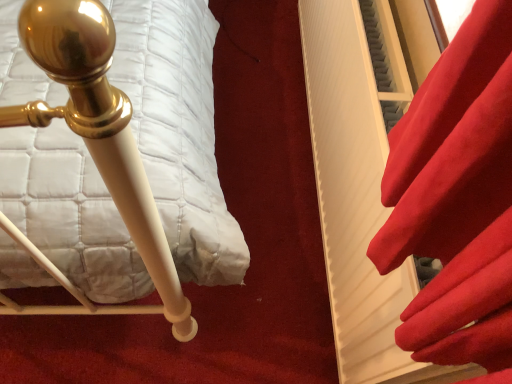
Describe the element at coordinates (457, 200) in the screenshot. This screenshot has height=384, width=512. I see `satin red curtain at right` at that location.

I want to click on satin red curtain at right, so click(x=457, y=200).

Measure the distance between satin red curtain at right and camera.

satin red curtain at right and camera are 12.86 inches apart from each other.

Identify the location of matte white bedpost at left. The width and height of the screenshot is (512, 384). (94, 148).

What do you see at coordinates (94, 148) in the screenshot?
I see `matte white bedpost at left` at bounding box center [94, 148].

Measure the distance between matte white bedpost at left and camera.

The depth of matte white bedpost at left is 30.01 centimeters.

Identify the location of satin red curtain at right. The image size is (512, 384). (457, 200).

Considering the relative positions of matte white bedpost at left and satin red curtain at right in the image provided, is matte white bedpost at left to the left or to the right of satin red curtain at right?

From the image, it's evident that matte white bedpost at left is to the left of satin red curtain at right.

Is matte white bedpost at left positioned behind satin red curtain at right?

Yes, matte white bedpost at left is behind satin red curtain at right.

Which point is more distant from viewer, (104, 309) or (385, 257)?

The point (104, 309) is farther.

From the image's perspective, is matte white bedpost at left located above or below satin red curtain at right?

matte white bedpost at left is below satin red curtain at right.

From a real-world perspective, is matte white bedpost at left positioned above or below satin red curtain at right?

In terms of real-world spatial position, matte white bedpost at left is below satin red curtain at right.

Considering the sizes of objects matte white bedpost at left and satin red curtain at right in the image provided, who is wider, matte white bedpost at left or satin red curtain at right?

With larger width is matte white bedpost at left.

Who is shorter, matte white bedpost at left or satin red curtain at right?

matte white bedpost at left.

Can you confirm if matte white bedpost at left is smaller than satin red curtain at right?

Actually, matte white bedpost at left might be larger than satin red curtain at right.

Is matte white bedpost at left spatially inside satin red curtain at right, or outside of it?

matte white bedpost at left cannot be found inside satin red curtain at right.

Is there a large distance between matte white bedpost at left and satin red curtain at right?

That's not correct — matte white bedpost at left is a little close to satin red curtain at right.

Is satin red curtain at right at the back of matte white bedpost at left?

No, matte white bedpost at left is not facing the opposite direction of satin red curtain at right.

Looking at this image, can you tell me how much matte white bedpost at left and satin red curtain at right differ in facing direction?

matte white bedpost at left and satin red curtain at right are facing 0.205 degrees away from each other.

Measure the distance between matte white bedpost at left and satin red curtain at right.

matte white bedpost at left is 16.22 inches from satin red curtain at right.

This screenshot has height=384, width=512. In order to click on furniture lying behind the satin red curtain at right in this screenshot , I will do `click(94, 148)`.

Which is more to the right, satin red curtain at right or matte white bedpost at left?

satin red curtain at right.

Is satin red curtain at right in front of matte white bedpost at left?

Yes, satin red curtain at right is in front of matte white bedpost at left.

Does point (449, 236) lie in front of point (10, 228)?

Yes, it is.

From the image's perspective, between satin red curtain at right and matte white bedpost at left, which one is located above?

satin red curtain at right appears higher in the image.

From a real-world perspective, is satin red curtain at right positioned above or below matte white bedpost at left?

satin red curtain at right is situated higher than matte white bedpost at left in the real world.

Between satin red curtain at right and matte white bedpost at left, which one has smaller width?

satin red curtain at right is thinner.

Does satin red curtain at right have a greater height compared to matte white bedpost at left?

Yes, satin red curtain at right is taller than matte white bedpost at left.

Can you confirm if satin red curtain at right is smaller than matte white bedpost at left?

Indeed, satin red curtain at right has a smaller size compared to matte white bedpost at left.

Is matte white bedpost at left located within satin red curtain at right?

That's incorrect, matte white bedpost at left is not inside satin red curtain at right.

Is satin red curtain at right next to matte white bedpost at left?

satin red curtain at right and matte white bedpost at left are not in contact.

Is matte white bedpost at left at the back of satin red curtain at right?

satin red curtain at right is not turned away from matte white bedpost at left.

What's the angular difference between satin red curtain at right and matte white bedpost at left's facing directions?

They differ by 0.205 degrees in their facing directions.

How much distance is there between satin red curtain at right and matte white bedpost at left?

satin red curtain at right and matte white bedpost at left are 41.19 centimeters apart.

At what (x,y) coordinates should I click in order to perform the action: click on curtain in front of the matte white bedpost at left. Please return your answer as a coordinate pair (x, y). The height and width of the screenshot is (384, 512). Looking at the image, I should click on (457, 200).

This screenshot has height=384, width=512. Find the location of `curtain in front of the matte white bedpost at left`. curtain in front of the matte white bedpost at left is located at coordinates (457, 200).

Locate an element on the screen. curtain above the matte white bedpost at left (from a real-world perspective) is located at coordinates (457, 200).